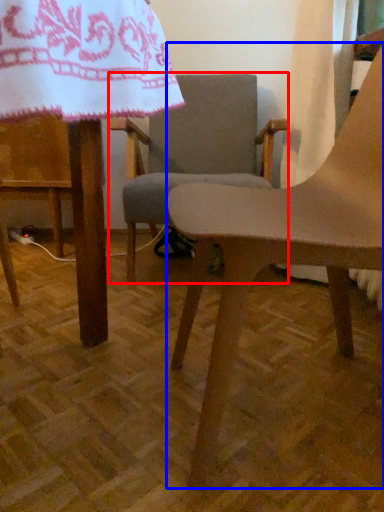
Question: Which of the following is the closest to the observer, chair (highlighted by a red box) or chair (highlighted by a blue box)?

Choices:
 (A) chair
 (B) chair

Answer: (B)